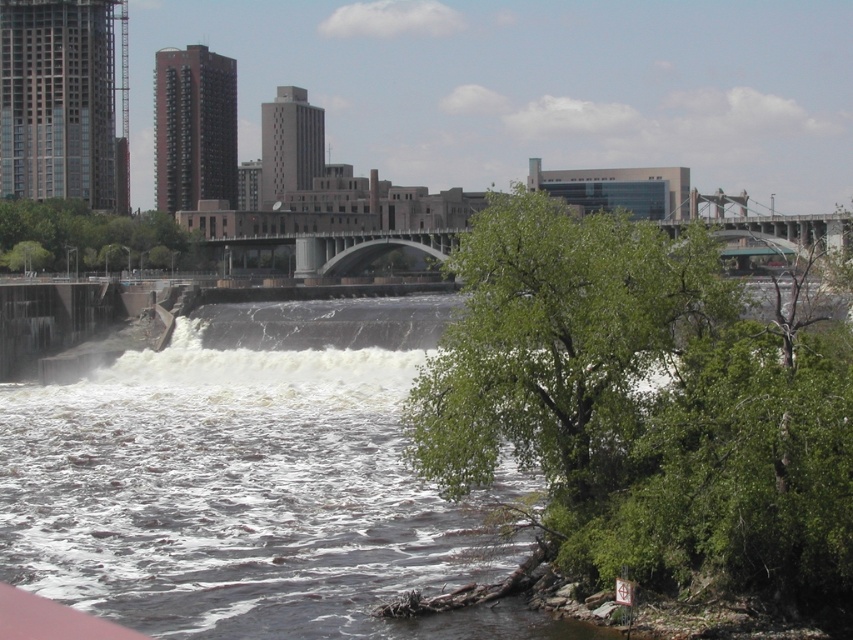
Based on the photo, can you confirm if white frothy water at center is shorter than green leafy tree at upper center?

Yes.

Does white frothy water at center appear under green leafy tree at upper center?

Correct, white frothy water at center is located below green leafy tree at upper center.

Does point (341, 365) come closer to viewer compared to point (138, 244)?

Yes, it is in front of point (138, 244).

Where is `white frothy water at center`? white frothy water at center is located at coordinates (279, 360).

Who is more distant from viewer, (x=769, y=589) or (x=323, y=323)?

The point (x=323, y=323) is more distant.

Which is above, green leafy tree at lower right or white frothy water at center?

white frothy water at center is higher up.

The width and height of the screenshot is (853, 640). Describe the element at coordinates (643, 403) in the screenshot. I see `green leafy tree at lower right` at that location.

Identify the location of green leafy tree at lower right. This screenshot has height=640, width=853. (643, 403).

Which is more to the left, green leafy tree at lower right or green leafy tree at upper center?

green leafy tree at upper center

Where is `green leafy tree at lower right`? This screenshot has height=640, width=853. green leafy tree at lower right is located at coordinates [x=643, y=403].